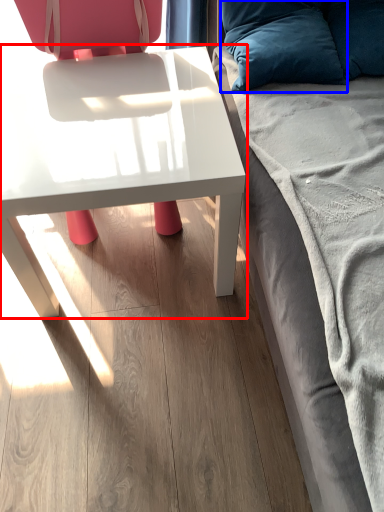
Question: Which object appears farthest to the camera in this image, table (highlighted by a red box) or pillow (highlighted by a blue box)?

Choices:
 (A) table
 (B) pillow

Answer: (B)